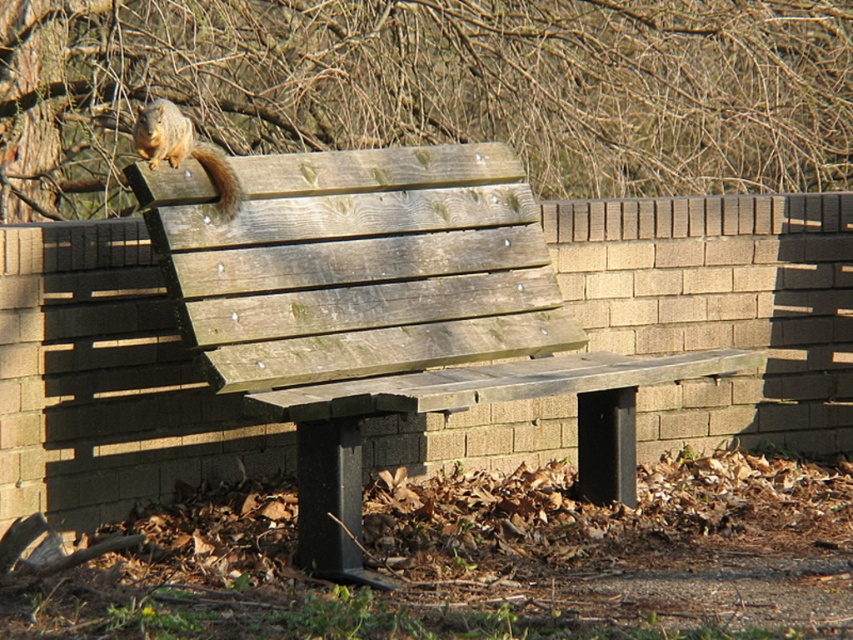
You are standing in a park and see the brown wood tree at upper center and the weathered wood bench at center. Which object is larger in size?

The brown wood tree at upper center is bigger than the weathered wood bench at center according to the description.

You are standing in a park and see the brown wood tree at upper center and the weathered wood bench at center. Which object is located to the right of the other?

The brown wood tree at upper center is positioned on the right side of weathered wood bench at center.

You are standing in front of the wooden bench and want to place a small object on the closest point between point (503, 81) and point (312, 385). Which point should you choose?

Point (312, 385) is closer to you than point (503, 81), so you should choose point (312, 385).